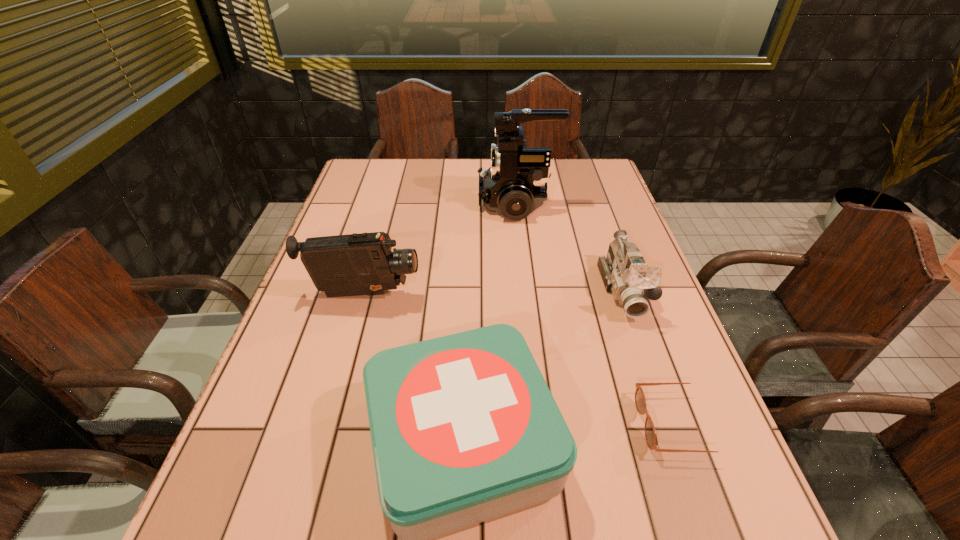
Identify the location of the farthest camcorder. This screenshot has width=960, height=540. pyautogui.click(x=515, y=185).

Identify the location of the farthest object. The image size is (960, 540). (515, 185).

You are a GUI agent. You are given a task and a screenshot of the screen. Output one action in this format:
    pyautogui.click(x=<x>, y=<y>)
    Task: Click on the fourth shortest object
    
    Given the screenshot: What is the action you would take?
    pyautogui.click(x=355, y=264)

Where is `the leftmost camcorder`? the leftmost camcorder is located at coordinates (355, 264).

Identify the location of the rightmost camcorder. (625, 274).

Identify the location of the shortest object. (640, 401).

Find the location of a particular element. This screenshot has width=960, height=540. free location located on the lens mount of the second camcorder from left to right is located at coordinates pos(397,203).

Locate an element on the screen. This screenshot has height=540, width=960. vacant space located 0.240m on the lens mount of the second camcorder from left to right is located at coordinates (400, 203).

Identify the location of vacant space located on the lens mount of the second camcorder from left to right. (422, 203).

Where is `vacant region located on the front-facing side of the second tallest object`? The height and width of the screenshot is (540, 960). vacant region located on the front-facing side of the second tallest object is located at coordinates (458, 294).